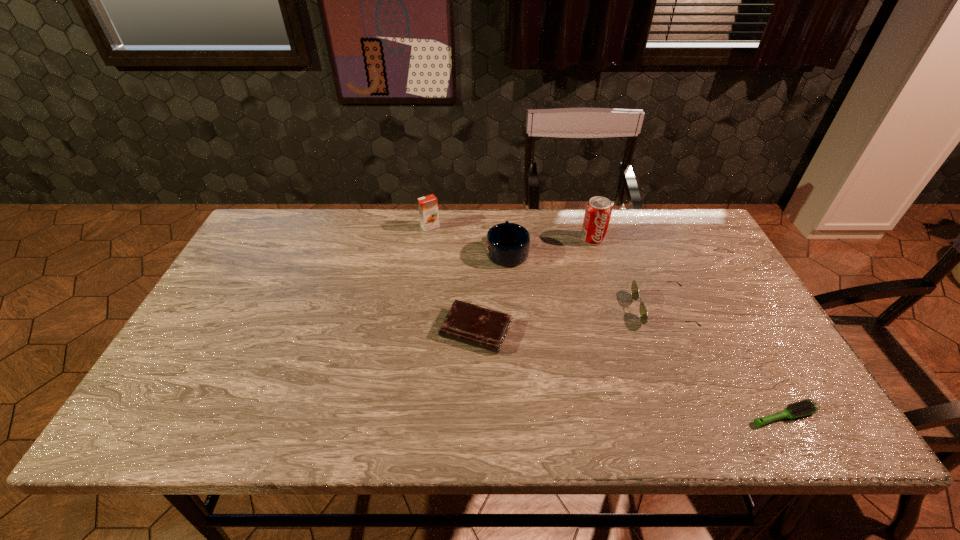
The image size is (960, 540). Find the location of `the tallest object`. the tallest object is located at coordinates (598, 211).

Where is `the fourth object from left to right`? the fourth object from left to right is located at coordinates (598, 211).

You are a GUI agent. You are given a task and a screenshot of the screen. Output one action in this format:
    pyautogui.click(x=<x>, y=<y>)
    Task: Click on the fifth shortest object
    This screenshot has width=960, height=540.
    Given the screenshot: What is the action you would take?
    [x=428, y=205]

Find the location of `orange juice`. orange juice is located at coordinates (428, 205).

At what (x,y) coordinates should I click in order to perform the action: click on mug. Please return your answer as a coordinate pair (x, y). Looking at the image, I should click on (507, 244).

Where is `the fourth tallest object`? This screenshot has width=960, height=540. the fourth tallest object is located at coordinates (634, 288).

Locate an element on the screen. the second object from right to left is located at coordinates (634, 288).

Where is `diary`? The width and height of the screenshot is (960, 540). diary is located at coordinates (465, 322).

At what (x,y) coordinates should I click in order to perform the action: click on the nearest object. Please return your answer as a coordinate pair (x, y). The height and width of the screenshot is (540, 960). Looking at the image, I should click on (805, 407).

The width and height of the screenshot is (960, 540). Find the location of `hairbrush`. hairbrush is located at coordinates tap(805, 407).